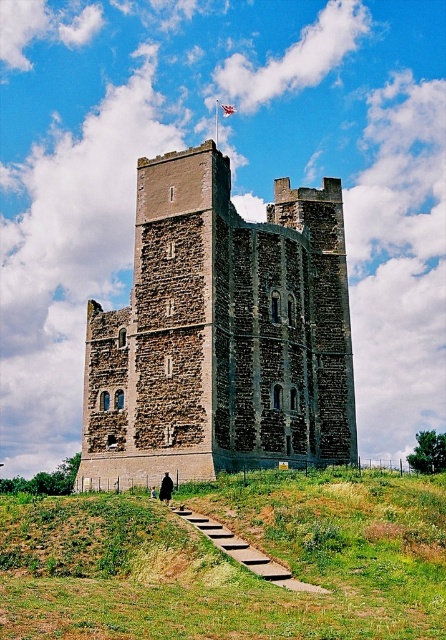
You are a visitor standing in front of the brown stone tower at center and the green grassy at lower center. Which object is bigger in size?

The brown stone tower at center is larger in size compared to the green grassy at lower center.